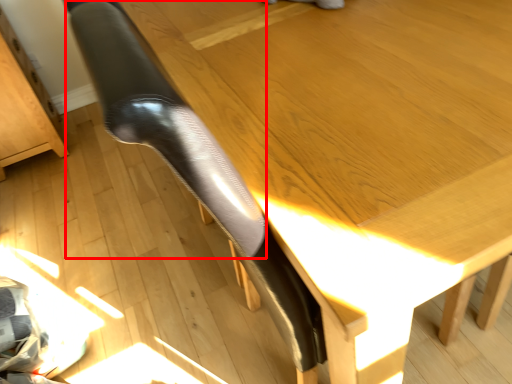
Question: Where is leg (annotated by the red box) located in relation to furniture in the image?

Choices:
 (A) right
 (B) left

Answer: (A)